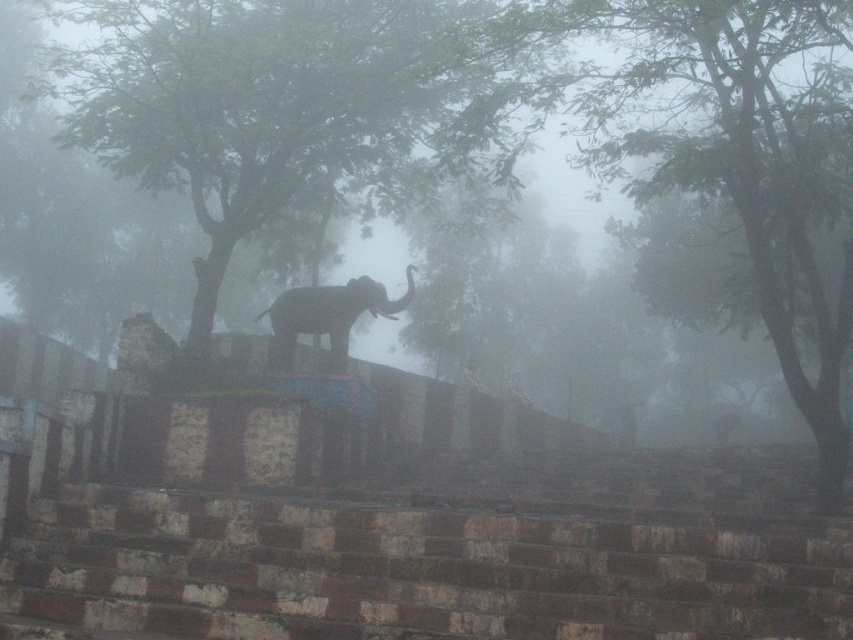
Question: Where is green leafy tree at center located in relation to silhouette stone elephant at center in the image?

Choices:
 (A) left
 (B) right

Answer: (A)

Question: Among these objects, which one is farthest from the camera?

Choices:
 (A) green leafy tree at center
 (B) green leafy tree at upper center
 (C) silhouette stone elephant at center

Answer: (C)

Question: Is green leafy tree at center to the left of green leafy tree at upper center from the viewer's perspective?

Choices:
 (A) no
 (B) yes

Answer: (B)

Question: Is the position of green leafy tree at upper center less distant than that of silhouette stone elephant at center?

Choices:
 (A) no
 (B) yes

Answer: (B)

Question: Among these objects, which one is farthest from the camera?

Choices:
 (A) green leafy tree at center
 (B) green leafy tree at upper center
 (C) silhouette stone elephant at center

Answer: (C)

Question: Which object appears farthest from the camera in this image?

Choices:
 (A) green leafy tree at upper center
 (B) silhouette stone elephant at center

Answer: (B)